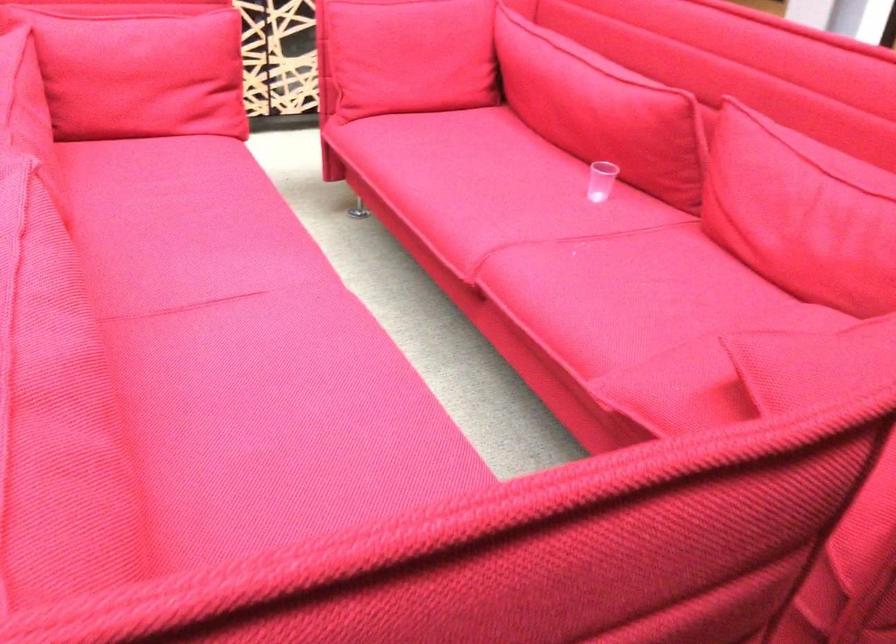
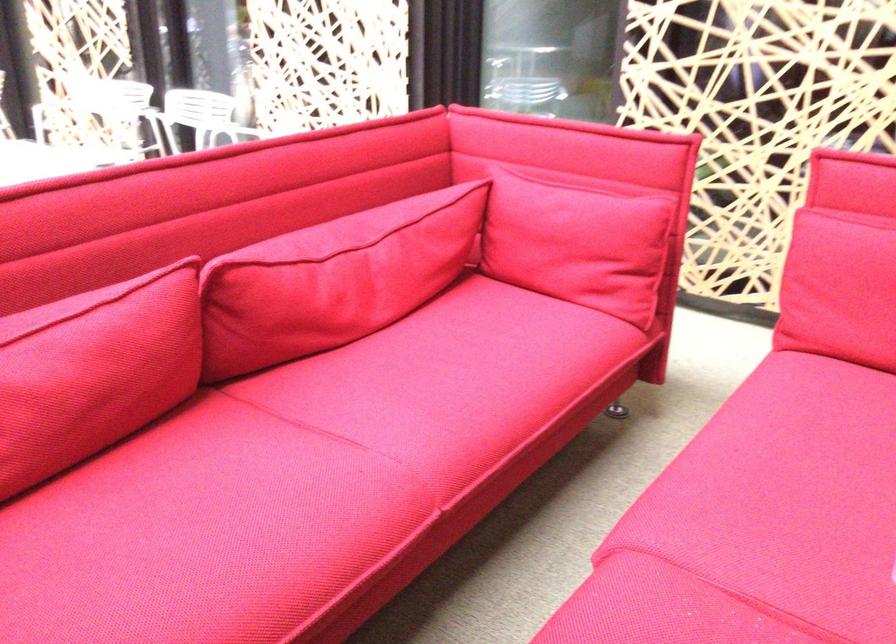
Where in the second image is the point corresponding to [76,312] from the first image?

(93, 371)